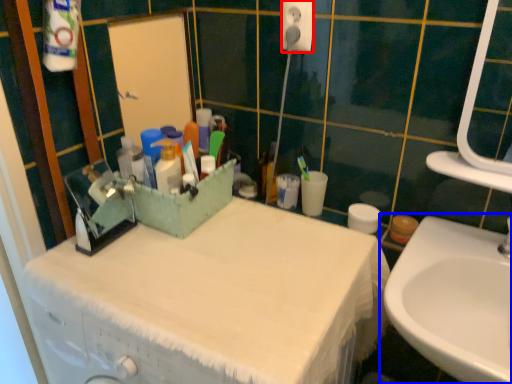
Question: Which object appears farthest to the camera in this image, electric outlet (highlighted by a red box) or sink (highlighted by a blue box)?

Choices:
 (A) electric outlet
 (B) sink

Answer: (A)